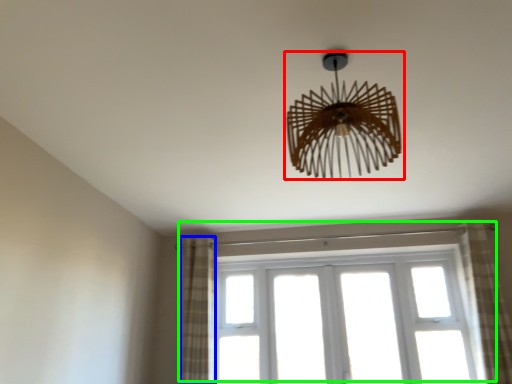
Question: Which is farther away from lamp (highlighted by a red box)? curtain (highlighted by a blue box) or window (highlighted by a green box)?

Choices:
 (A) curtain
 (B) window

Answer: (B)